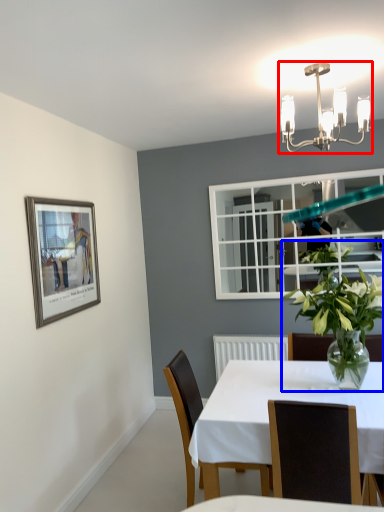
Question: Among these objects, which one is farthest to the camera, light fixture (highlighted by a red box) or houseplant (highlighted by a blue box)?

Choices:
 (A) light fixture
 (B) houseplant

Answer: (B)